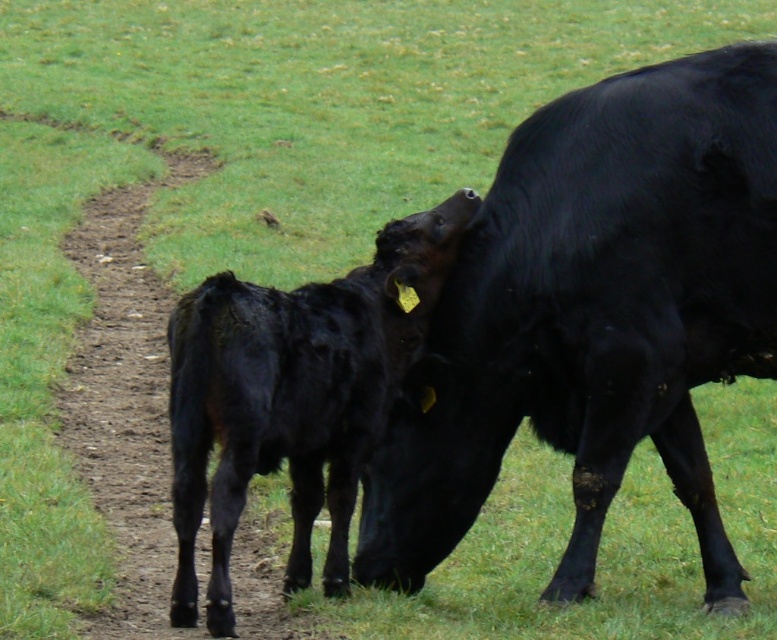
You are a farmer checking the herd. You see the black smooth cow at center and the shiny black calf at center. Which one is bigger?

The black smooth cow at center is larger in size than the shiny black calf at center.

You are standing at the bottom left corner of the image. You want to walk to the black smooth cow at center. Which direction should you walk? Please answer with a single word like north, south, etc. or a combination like northwest.

The black smooth cow at center is located at point (x=594, y=314). Since you are at the bottom left corner, you should walk northeast to reach it.

You are a farmer checking on your herd. You notice two animals in the field. Which one is positioned to the right of the other? The animals are the black smooth cow at center and the shiny black calf at center.

The black smooth cow at center is positioned to the right of the shiny black calf at center.